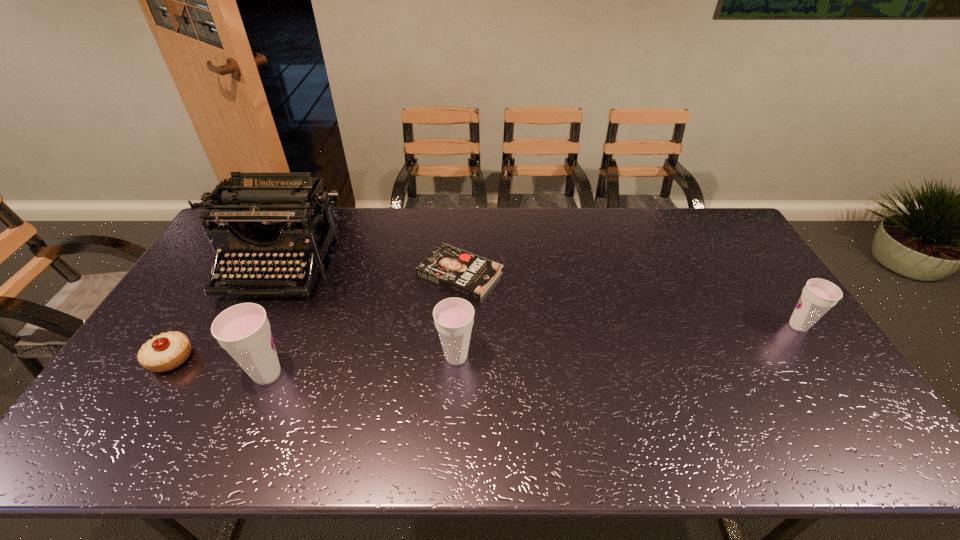
To achieve even spacing by inserting another cup among them, please point to a vacant spot for this new cup. Please provide its 2D coordinates. Your answer should be formatted as a tuple, i.e. [(x, y)], where the tuple contains the x and y coordinates of a point satisfying the conditions above.

[(633, 341)]